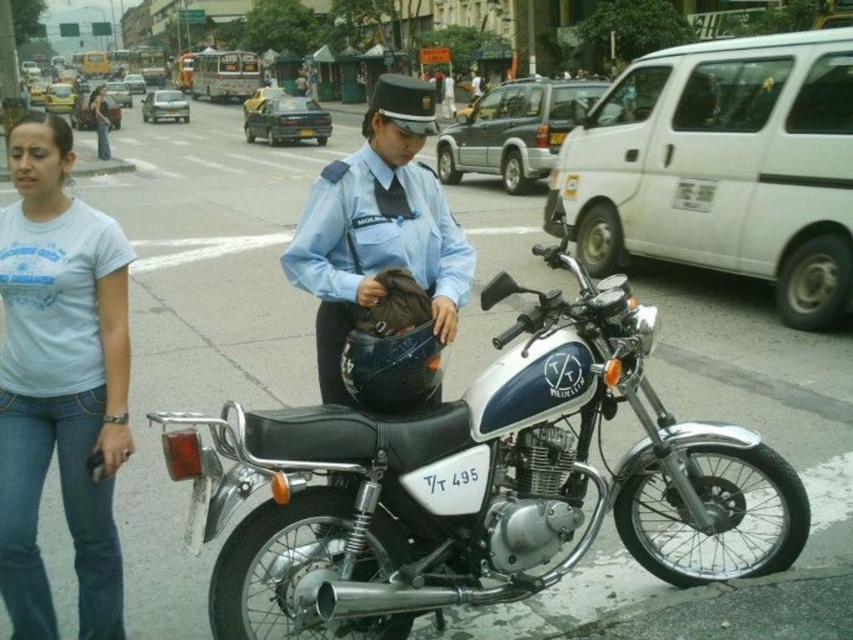
Question: Which point is farther to the camera?

Choices:
 (A) white metallic motorcycle at center
 (B) light blue uniform at center

Answer: (B)

Question: Is white metallic motorcycle at center to the left of light blue cotton t-shirt at lower left from the viewer's perspective?

Choices:
 (A) yes
 (B) no

Answer: (B)

Question: Is light blue cotton t-shirt at lower left to the right of light blue uniform at center from the viewer's perspective?

Choices:
 (A) no
 (B) yes

Answer: (A)

Question: Is light blue cotton t-shirt at lower left to the left of light blue uniform at center from the viewer's perspective?

Choices:
 (A) no
 (B) yes

Answer: (B)

Question: Which object is closer to the camera taking this photo?

Choices:
 (A) light blue cotton t-shirt at lower left
 (B) white metallic motorcycle at center
 (C) light blue uniform at center

Answer: (B)

Question: Based on their relative distances, which object is nearer to the white metallic motorcycle at center?

Choices:
 (A) light blue cotton t-shirt at lower left
 (B) light blue uniform at center

Answer: (B)